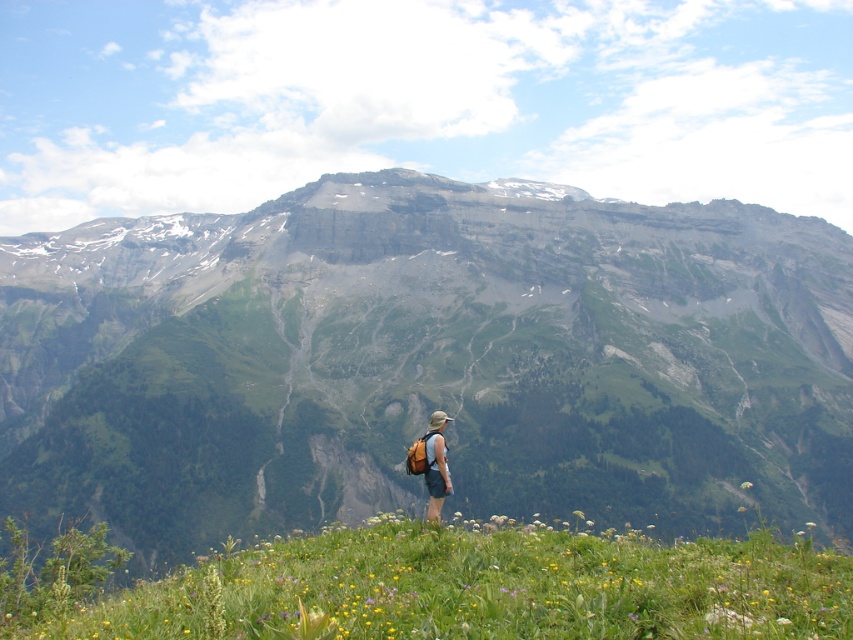
Question: Estimate the real-world distances between objects in this image. Which object is farther from the green grassy at lower center?

Choices:
 (A) matte khaki shorts at center
 (B) green matte flower at lower right

Answer: (B)

Question: Does green grassy hillside at lower center have a lesser width compared to green grassy at lower center?

Choices:
 (A) yes
 (B) no

Answer: (B)

Question: Is green grassy hillside at lower center bigger than matte khaki shorts at center?

Choices:
 (A) yes
 (B) no

Answer: (A)

Question: Which point appears closest to the camera in this image?

Choices:
 (A) (308, 288)
 (B) (148, 592)
 (C) (740, 484)
 (D) (434, 486)

Answer: (B)

Question: Estimate the real-world distances between objects in this image. Which object is farther from the green grassy at lower center?

Choices:
 (A) matte khaki shorts at center
 (B) green matte flower at lower right

Answer: (B)

Question: Does matte khaki shorts at center come in front of green matte flower at lower right?

Choices:
 (A) yes
 (B) no

Answer: (A)